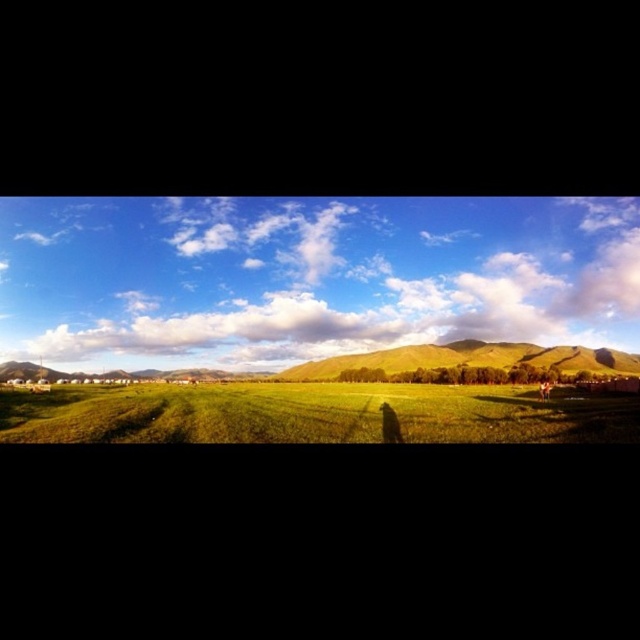
Is white fluffy cloud at upper center thinner than brown textured hair at lower right?

Incorrect, white fluffy cloud at upper center's width is not less than brown textured hair at lower right's.

Who is positioned more to the right, white fluffy cloud at upper center or brown textured hair at lower right?

brown textured hair at lower right is more to the right.

Where is `white fluffy cloud at upper center`? The image size is (640, 640). white fluffy cloud at upper center is located at coordinates (308, 276).

Which is in front, point (472, 396) or point (548, 396)?

Point (548, 396)

Does point (509, 416) come closer to viewer compared to point (541, 397)?

Yes, it is.

This screenshot has width=640, height=640. What are the coordinates of `green grassy field at center` in the screenshot? It's located at (314, 413).

Can you confirm if green grassy field at center is shorter than green grassy hill at center?

Yes.

Between point (344, 420) and point (483, 355), which one is positioned in front?

Point (344, 420) is more forward.

This screenshot has height=640, width=640. What are the coordinates of `green grassy field at center` in the screenshot? It's located at (314, 413).